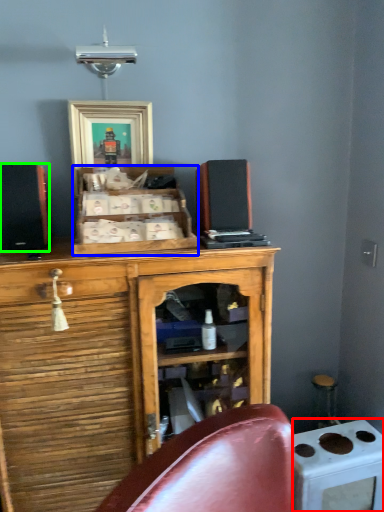
Question: Estimate the real-world distances between objects in this image. Which object is closer to appliance (highlighted by a red box), cabinetry (highlighted by a blue box) or speaker (highlighted by a green box)?

Choices:
 (A) cabinetry
 (B) speaker

Answer: (A)